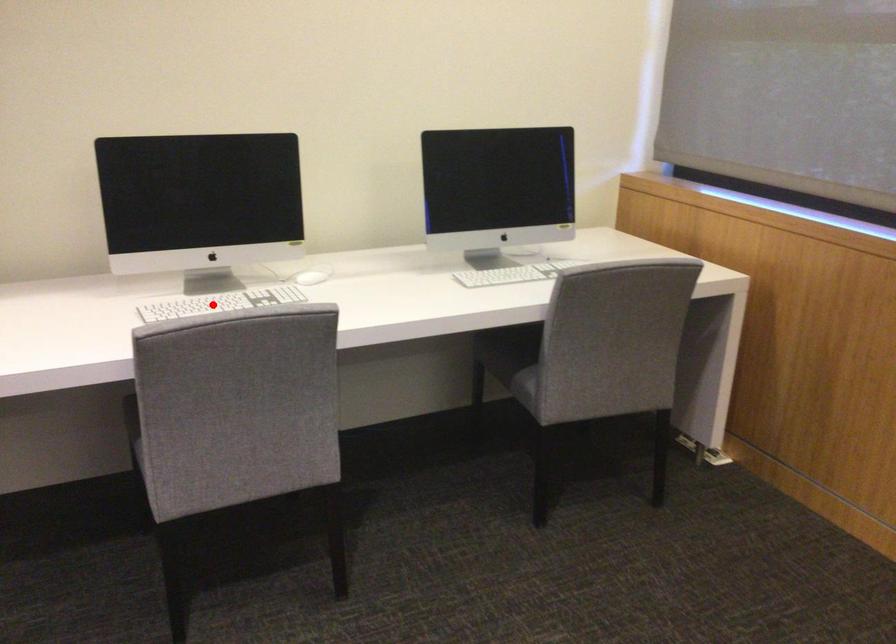
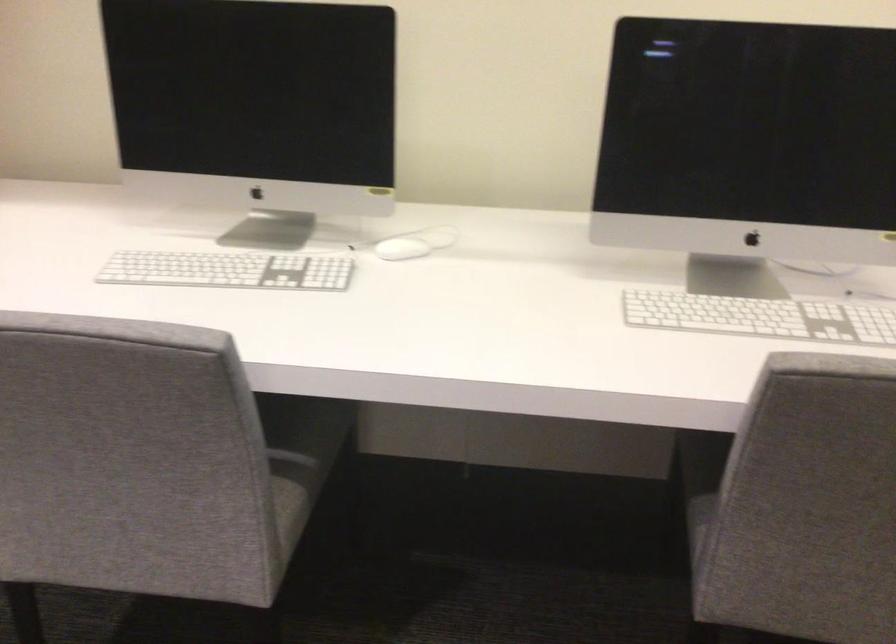
Question: I am providing you with two images of the same scene from different viewpoints. In image1, a red point is highlighted. Considering the same 3D point in image2, which of the following is correct?

Choices:
 (A) It is closer
 (B) It is farther

Answer: (A)